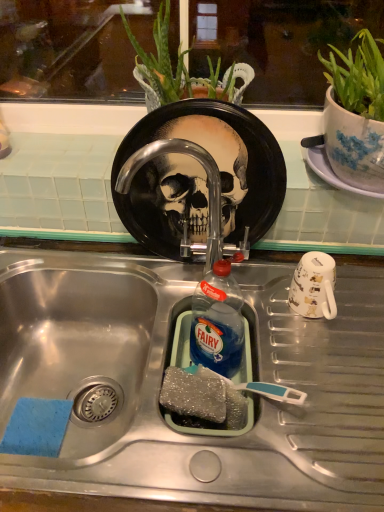
Find the location of a particular element. The height and width of the screenshot is (512, 384). free area behind sparkly gray sponge at sink bottom is located at coordinates (193, 332).